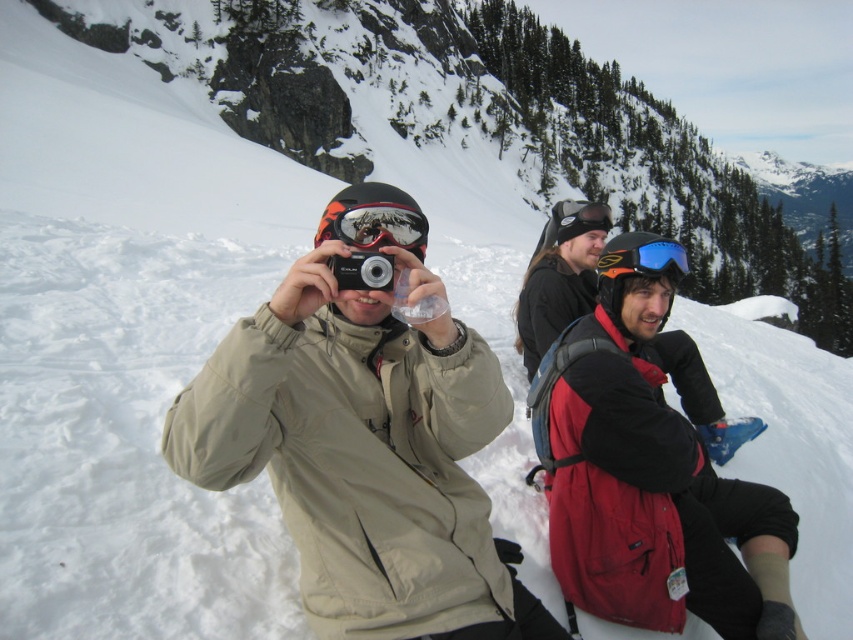
Question: Can you confirm if matte black goggles at center is bigger than blue reflective lens goggles at upper center?

Choices:
 (A) yes
 (B) no

Answer: (B)

Question: Which point is closer to the camera?

Choices:
 (A) (184, 420)
 (B) (569, 230)
 (C) (663, 253)

Answer: (A)

Question: Among these objects, which one is nearest to the camera?

Choices:
 (A) blue reflective lens goggles at upper center
 (B) matte black goggles at center
 (C) blue reflective goggles at upper center
 (D) matte khaki jacket at center

Answer: (D)

Question: Is matte khaki jacket at center closer to the viewer compared to matte black goggles at center?

Choices:
 (A) no
 (B) yes

Answer: (B)

Question: Considering the relative positions of matte khaki jacket at center and matte black goggles at center in the image provided, where is matte khaki jacket at center located with respect to matte black goggles at center?

Choices:
 (A) below
 (B) above

Answer: (A)

Question: Which is farther from the matte khaki jacket at center?

Choices:
 (A) blue reflective goggles at upper center
 (B) blue reflective lens goggles at upper center

Answer: (A)